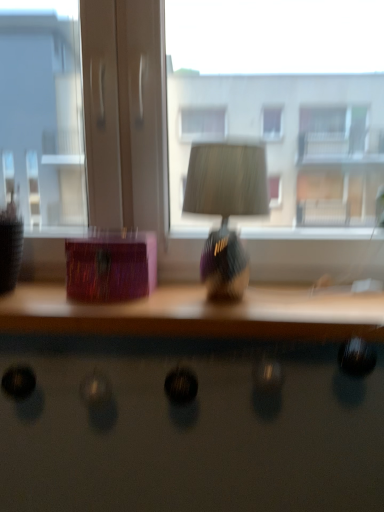
Question: In terms of width, does shiny black desk at lower center look wider or thinner when compared to wooden table at center?

Choices:
 (A) thin
 (B) wide

Answer: (A)

Question: Is shiny black desk at lower center bigger or smaller than wooden table at center?

Choices:
 (A) small
 (B) big

Answer: (A)

Question: Estimate the real-world distances between objects in this image. Which object is farther from the wooden table at center?

Choices:
 (A) shiny purple lampshade at center
 (B) transparent glass window at center
 (C) shiny black desk at lower center

Answer: (B)

Question: Based on their relative distances, which object is farther from the shiny purple lampshade at center?

Choices:
 (A) wooden table at center
 (B) shiny black desk at lower center
 (C) transparent glass window at center

Answer: (C)